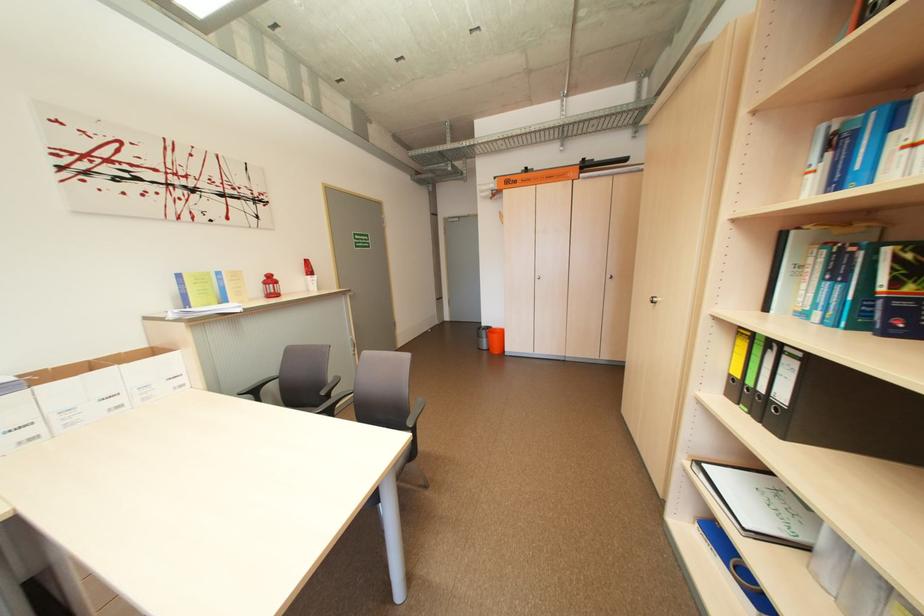
You are a GUI agent. You are given a task and a screenshot of the screen. Output one action in this format:
    pyautogui.click(x=<x>, y=<y>)
    Task: Click on the yellow ring binder
    The image size is (924, 616).
    Given the screenshot: What is the action you would take?
    [737, 363]